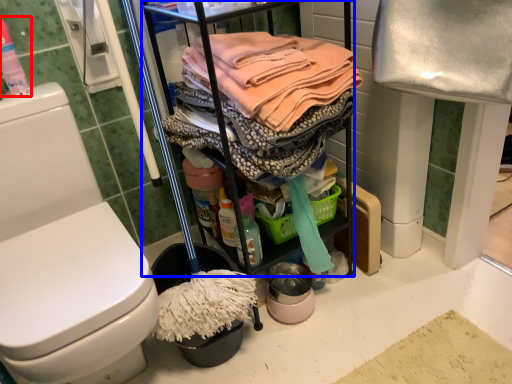
Question: Which point is further to the camera, cleaning products (highlighted by a red box) or cabinetry (highlighted by a blue box)?

Choices:
 (A) cleaning products
 (B) cabinetry

Answer: (A)